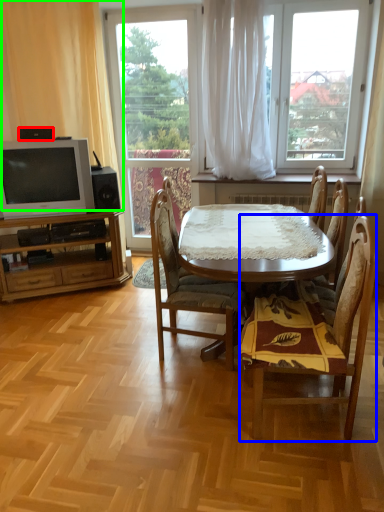
Question: Considering the real-world distances, which object is closest to loudspeaker (highlighted by a red box)? chair (highlighted by a blue box) or curtain (highlighted by a green box).

Choices:
 (A) chair
 (B) curtain

Answer: (B)